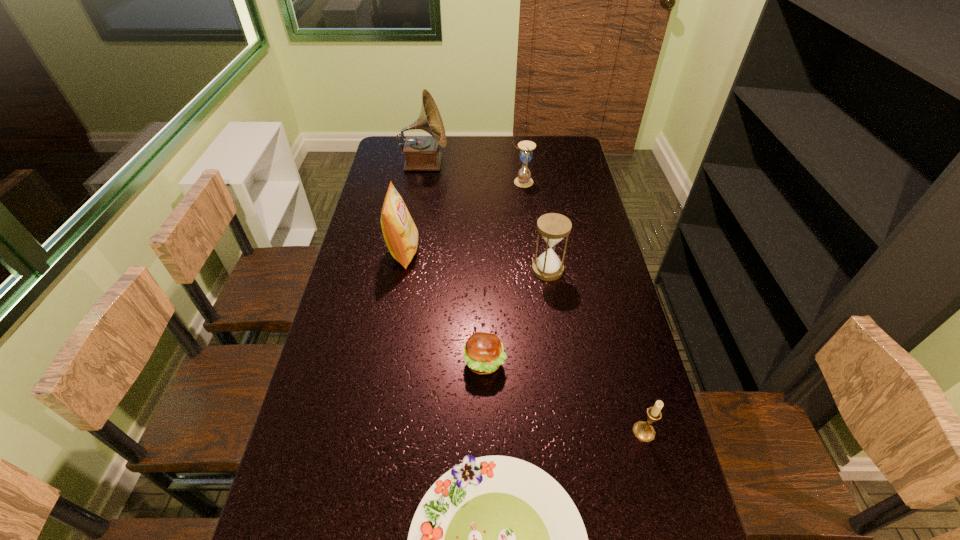
Where is `vacant region at the far edge of the desktop`? The image size is (960, 540). vacant region at the far edge of the desktop is located at coordinates (481, 138).

The width and height of the screenshot is (960, 540). What are the coordinates of `vacant position at the left edge of the desktop` in the screenshot? It's located at (288, 531).

This screenshot has height=540, width=960. In order to click on vacant area at the right edge in this screenshot , I will do `click(610, 286)`.

The width and height of the screenshot is (960, 540). Identify the location of vacant space at the far right corner. (563, 164).

At what (x,y) coordinates should I click in order to perform the action: click on vacant area that lies between the sixth tallest object and the nearer hourglass. Please return your answer as a coordinate pair (x, y). Looking at the image, I should click on (516, 316).

Identify the location of unoccupied area between the second shortest object and the rightmost object. Image resolution: width=960 pixels, height=540 pixels. (564, 397).

This screenshot has width=960, height=540. In order to click on vacant area between the tallest object and the hamburger in this screenshot , I will do `click(454, 263)`.

The width and height of the screenshot is (960, 540). Find the location of `vacant area that lies between the nearer hourglass and the crisp (potato chip)`. vacant area that lies between the nearer hourglass and the crisp (potato chip) is located at coordinates (475, 261).

Image resolution: width=960 pixels, height=540 pixels. What are the coordinates of `vacant space that is in between the rightmost object and the fifth farthest object` in the screenshot? It's located at (564, 397).

You are a GUI agent. You are given a task and a screenshot of the screen. Output one action in this format:
    pyautogui.click(x=<x>, y=<y>)
    Task: Click on the free space between the nearer hourglass and the phonograph record
    Image resolution: width=960 pixels, height=540 pixels.
    Given the screenshot: What is the action you would take?
    pyautogui.click(x=486, y=217)